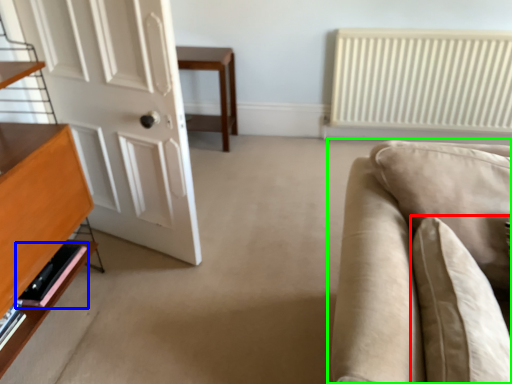
Question: Estimate the real-world distances between objects in this image. Which object is farther from pillow (highlighted by a red box), shelf (highlighted by a blue box) or studio couch (highlighted by a green box)?

Choices:
 (A) shelf
 (B) studio couch

Answer: (A)